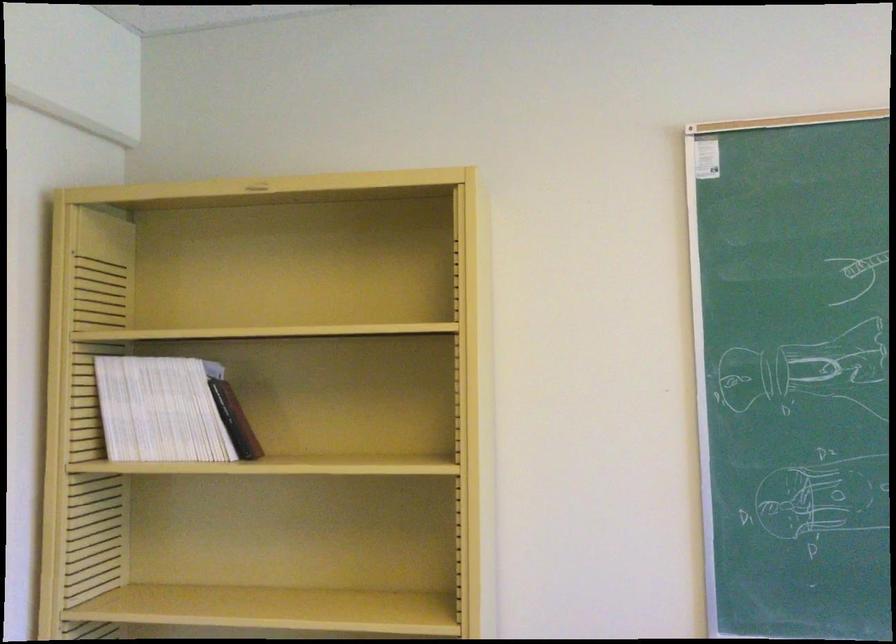
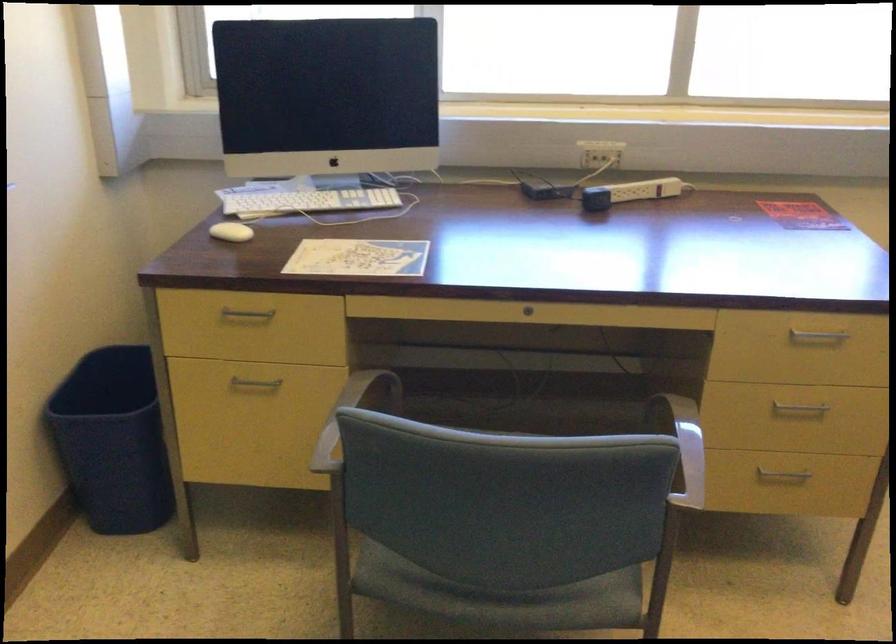
From the picture: The first image is from the beginning of the video and the second image is from the end. How did the camera likely rotate when shooting the video?

The camera's rotation is toward right-down.